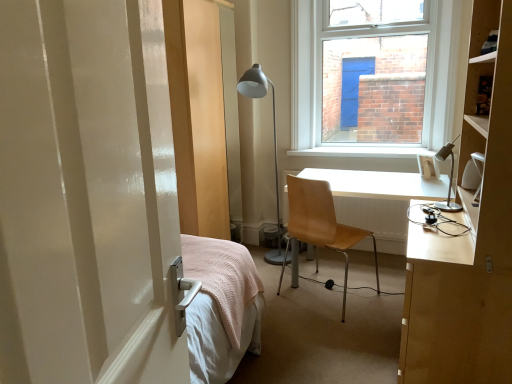
Question: From a real-world perspective, is light brown wood desk at center right positioned above or below light brown wood chair at center?

Choices:
 (A) above
 (B) below

Answer: (B)

Question: Looking at their shapes, would you say light brown wood desk at center right is wider or thinner than light brown wood chair at center?

Choices:
 (A) thin
 (B) wide

Answer: (B)

Question: Which is farther from the light brown wood desk at center right?

Choices:
 (A) white plastic picture frame at upper right
 (B) light brown wood chair at center
 (C) matte gray floor lamp at center, the first lamp positioned from the back
 (D) silver metallic desk lamp at right, the second lamp in the left-to-right sequence

Answer: (C)

Question: Which of these objects is positioned farthest from the matte gray floor lamp at center, the first lamp positioned from the back?

Choices:
 (A) light brown wood chair at center
 (B) silver metallic desk lamp at right, which is counted as the first lamp, starting from the right
 (C) white plastic picture frame at upper right
 (D) light brown wood desk at center right

Answer: (B)